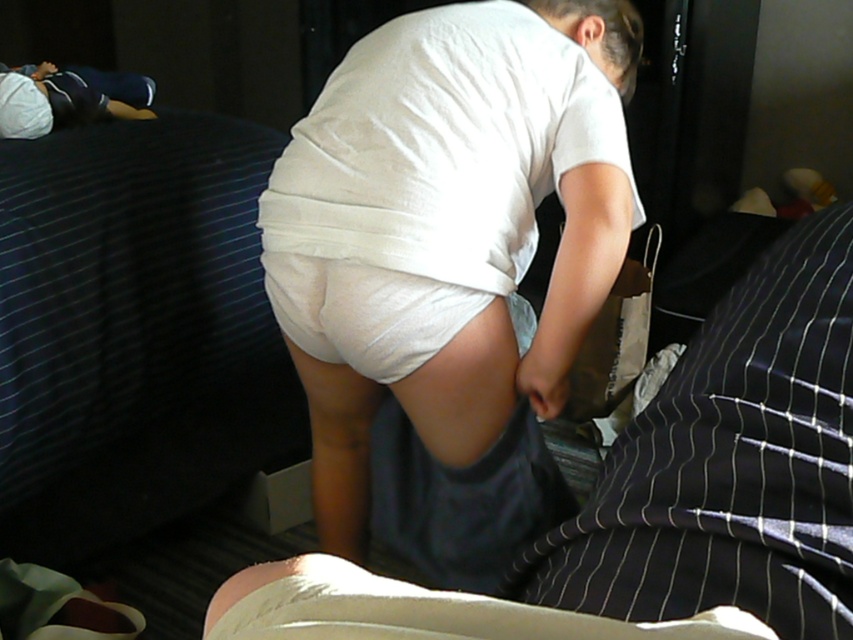
Question: Is white matte shorts at center bigger than white cotton shirt at upper left?

Choices:
 (A) yes
 (B) no

Answer: (A)

Question: Among these objects, which one is farthest from the camera?

Choices:
 (A) white cotton shirt at upper left
 (B) dark blue striped bed at left

Answer: (A)

Question: Is white matte shorts at center smaller than dark blue striped bed at left?

Choices:
 (A) no
 (B) yes

Answer: (A)

Question: Which of these objects is positioned closest to the white matte shorts at center?

Choices:
 (A) white cotton shirt at upper left
 (B) dark blue striped bed at left

Answer: (B)

Question: Is white matte shorts at center above white cotton shirt at upper left?

Choices:
 (A) no
 (B) yes

Answer: (A)

Question: Which point appears farthest from the camera in this image?

Choices:
 (A) (122, 74)
 (B) (595, 276)
 (C) (107, 483)

Answer: (A)